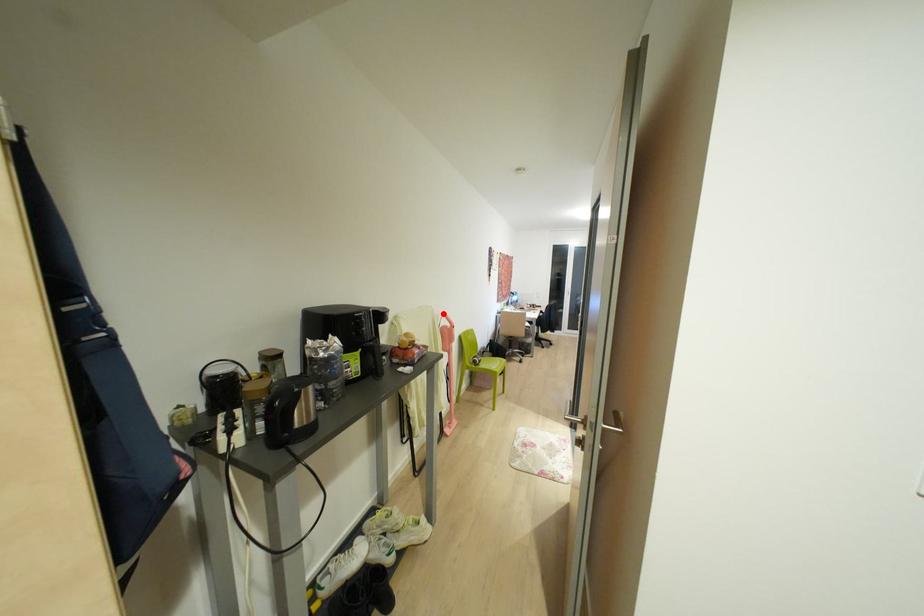
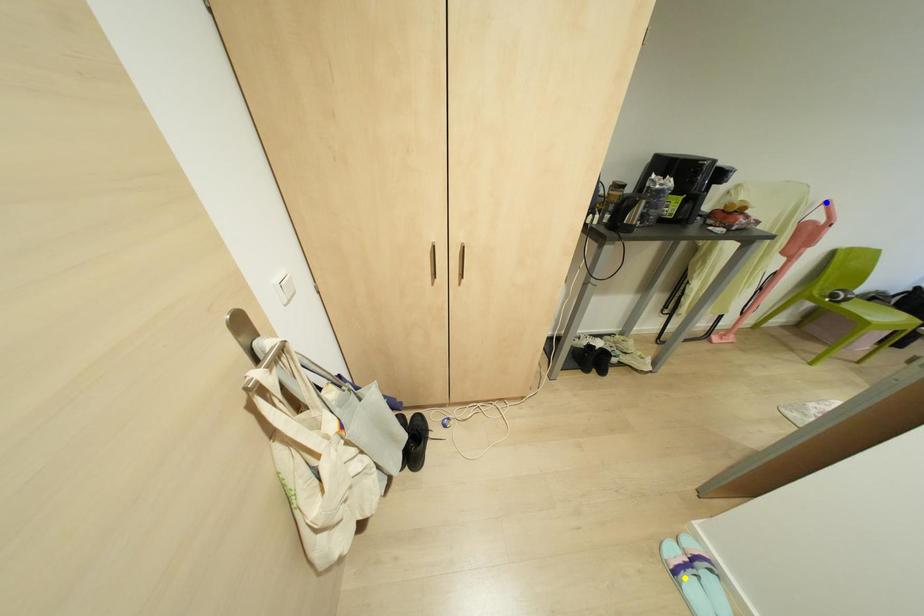
Question: I am providing you with two images of the same scene from different viewpoints. A red point is marked on the first image. You are given multiple points on the second image. Can you choose the point in image 2 that corresponds to the point in image 1?

Choices:
 (A) blue point
 (B) green point
 (C) yellow point

Answer: (A)